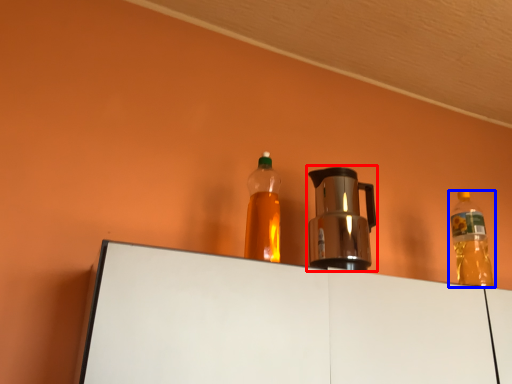
Question: Which of the following is the farthest to the observer, coffeepot (highlighted by a red box) or bottle (highlighted by a blue box)?

Choices:
 (A) coffeepot
 (B) bottle

Answer: (B)